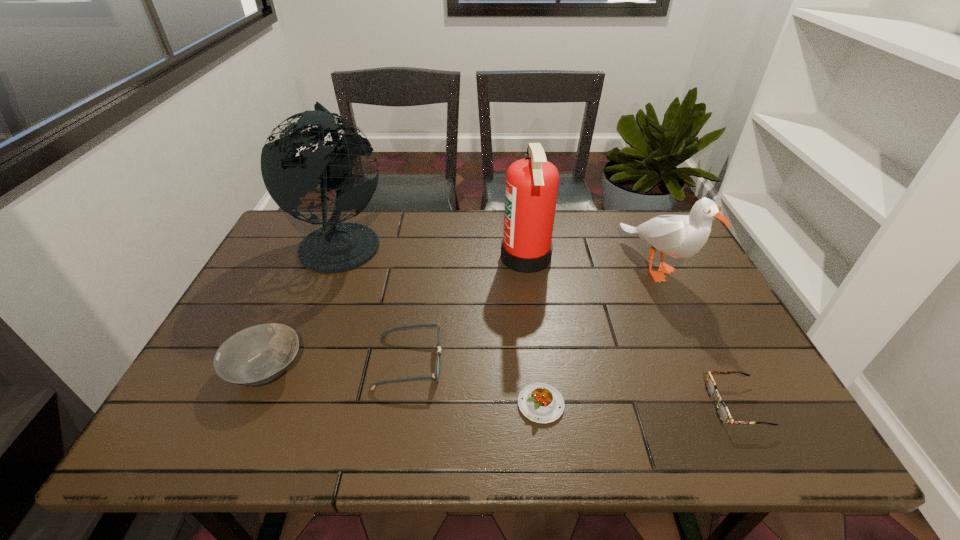
Locate an element on the screen. The height and width of the screenshot is (540, 960). free spot that satisfies the following two spatial constraints: 1. at the nozzle of the fire extinguisher; 2. on the front side of the pudding is located at coordinates (544, 404).

Identify the location of free space that satisfies the following two spatial constraints: 1. at the beak of the fifth shortest object; 2. on the face of the left spectacles. The height and width of the screenshot is (540, 960). (701, 362).

Identify the location of free location that satisfies the following two spatial constraints: 1. on the face of the fifth tallest object; 2. on the back side of the pudding. This screenshot has width=960, height=540. (402, 404).